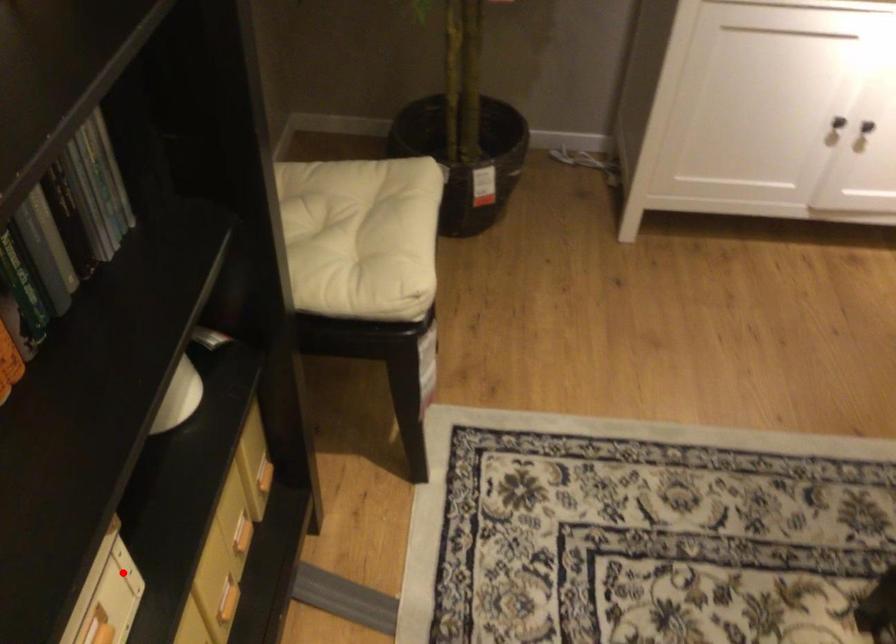
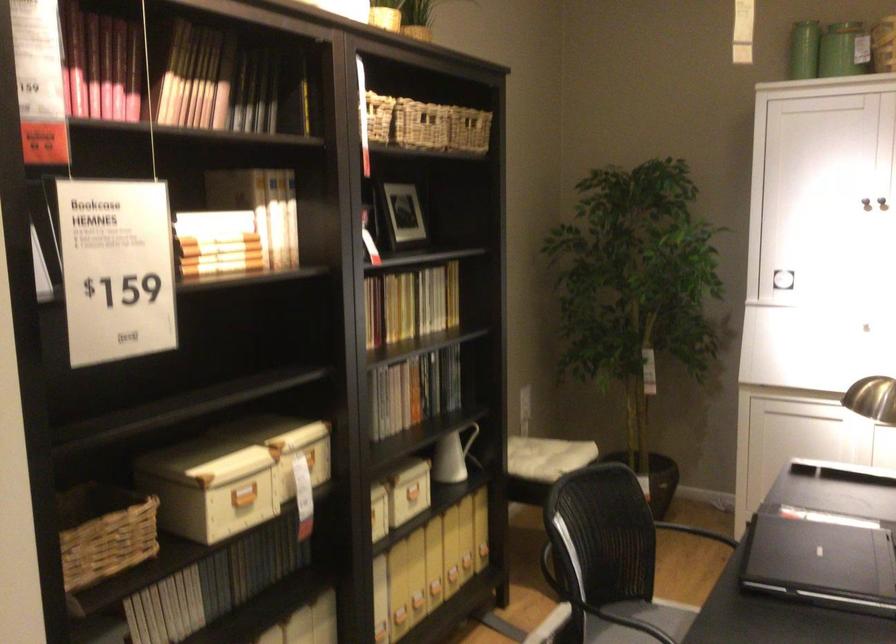
Question: I am providing you with two images of the same scene from different viewpoints. Image1 has a red point marked. In image2, the corresponding 3D location appears at what relative position? Reply with the corresponding letter.

Choices:
 (A) Closer
 (B) Farther

Answer: (B)